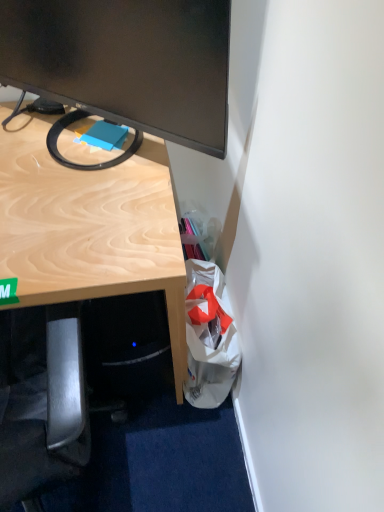
Question: Is white fabric bag at lower right to the right of matte black monitor at upper left from the viewer's perspective?

Choices:
 (A) no
 (B) yes

Answer: (B)

Question: From a real-world perspective, is white fabric bag at lower right physically above matte black monitor at upper left?

Choices:
 (A) no
 (B) yes

Answer: (A)

Question: Are white fabric bag at lower right and matte black monitor at upper left located far from each other?

Choices:
 (A) no
 (B) yes

Answer: (A)

Question: Considering the relative sizes of white fabric bag at lower right and matte black monitor at upper left in the image provided, is white fabric bag at lower right bigger than matte black monitor at upper left?

Choices:
 (A) yes
 (B) no

Answer: (B)

Question: Is white fabric bag at lower right looking in the opposite direction of matte black monitor at upper left?

Choices:
 (A) no
 (B) yes

Answer: (A)

Question: Is white fabric bag at lower right outside matte black monitor at upper left?

Choices:
 (A) yes
 (B) no

Answer: (A)

Question: Considering the relative sizes of matte black monitor at upper left and white fabric bag at lower right in the image provided, is matte black monitor at upper left wider than white fabric bag at lower right?

Choices:
 (A) yes
 (B) no

Answer: (B)

Question: Can you confirm if matte black monitor at upper left is taller than white fabric bag at lower right?

Choices:
 (A) no
 (B) yes

Answer: (B)

Question: Is matte black monitor at upper left not close to white fabric bag at lower right?

Choices:
 (A) no
 (B) yes

Answer: (A)

Question: Is white fabric bag at lower right a part of matte black monitor at upper left?

Choices:
 (A) yes
 (B) no

Answer: (B)

Question: Can you confirm if matte black monitor at upper left is thinner than white fabric bag at lower right?

Choices:
 (A) yes
 (B) no

Answer: (A)

Question: Does matte black monitor at upper left have a lesser height compared to white fabric bag at lower right?

Choices:
 (A) no
 (B) yes

Answer: (A)

Question: Considering the positions of white fabric bag at lower right and matte black monitor at upper left in the image, is white fabric bag at lower right wider or thinner than matte black monitor at upper left?

Choices:
 (A) wide
 (B) thin

Answer: (A)